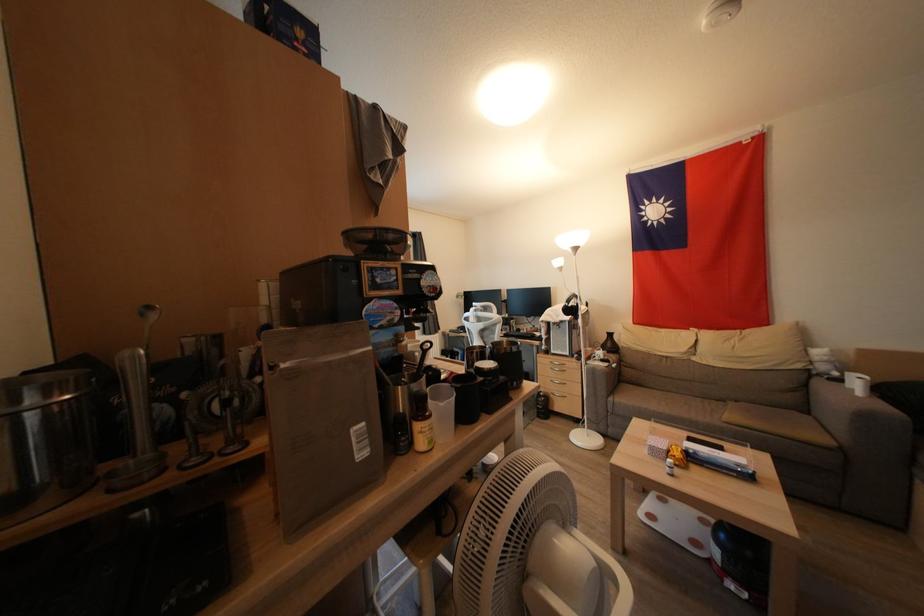
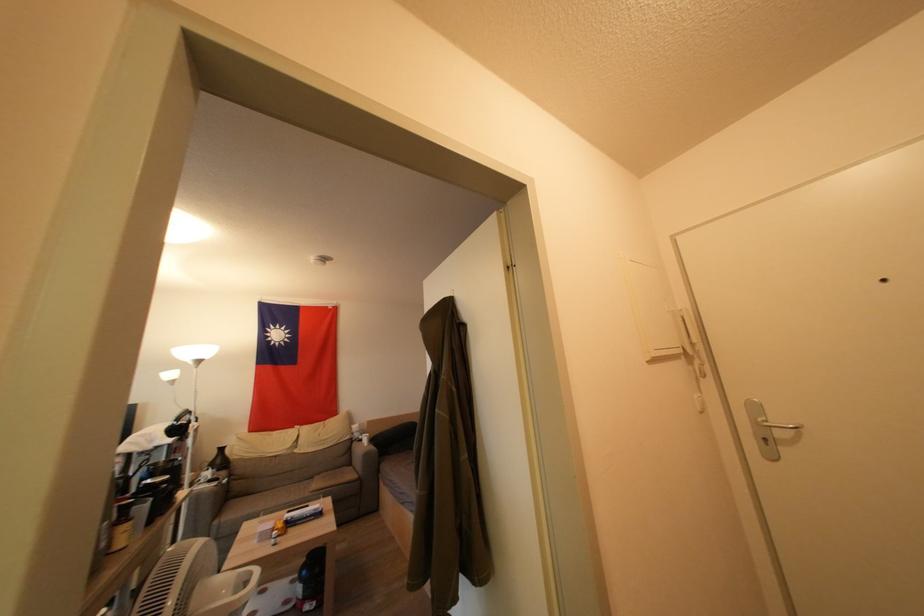
In the second image, find the point that corresponds to the point at 614,403 in the first image.

(221, 525)